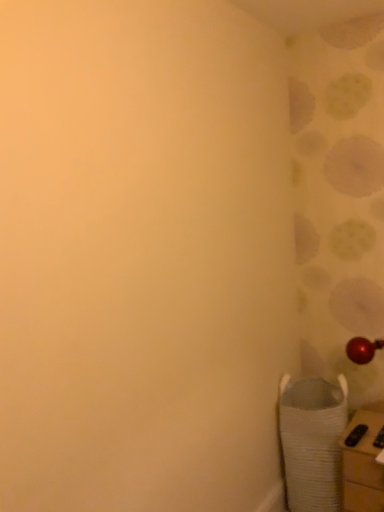
Question: Can you confirm if white cardboard box at lower right is bigger than white woven laundry basket at lower right?

Choices:
 (A) yes
 (B) no

Answer: (B)

Question: Is white cardboard box at lower right not close to white woven laundry basket at lower right?

Choices:
 (A) no
 (B) yes

Answer: (A)

Question: From the image's perspective, is white cardboard box at lower right located beneath white woven laundry basket at lower right?

Choices:
 (A) no
 (B) yes

Answer: (B)

Question: Does white cardboard box at lower right appear on the left side of white woven laundry basket at lower right?

Choices:
 (A) yes
 (B) no

Answer: (B)

Question: Considering the relative positions of white cardboard box at lower right and white woven laundry basket at lower right in the image provided, is white cardboard box at lower right in front of white woven laundry basket at lower right?

Choices:
 (A) yes
 (B) no

Answer: (A)

Question: Is white cardboard box at lower right further to the viewer compared to white woven laundry basket at lower right?

Choices:
 (A) no
 (B) yes

Answer: (A)

Question: From the image's perspective, is white woven laundry basket at lower right located beneath white cardboard box at lower right?

Choices:
 (A) no
 (B) yes

Answer: (A)

Question: Is white woven laundry basket at lower right to the left of white cardboard box at lower right from the viewer's perspective?

Choices:
 (A) no
 (B) yes

Answer: (B)

Question: Does white woven laundry basket at lower right have a lesser width compared to white cardboard box at lower right?

Choices:
 (A) no
 (B) yes

Answer: (A)

Question: Could you tell me if white woven laundry basket at lower right is turned towards white cardboard box at lower right?

Choices:
 (A) no
 (B) yes

Answer: (A)

Question: Considering the relative sizes of white woven laundry basket at lower right and white cardboard box at lower right in the image provided, is white woven laundry basket at lower right wider than white cardboard box at lower right?

Choices:
 (A) no
 (B) yes

Answer: (B)

Question: Is white woven laundry basket at lower right oriented away from white cardboard box at lower right?

Choices:
 (A) yes
 (B) no

Answer: (B)

Question: Does point pyautogui.click(x=372, y=471) appear closer or farther from the camera than point pyautogui.click(x=317, y=381)?

Choices:
 (A) closer
 (B) farther

Answer: (A)